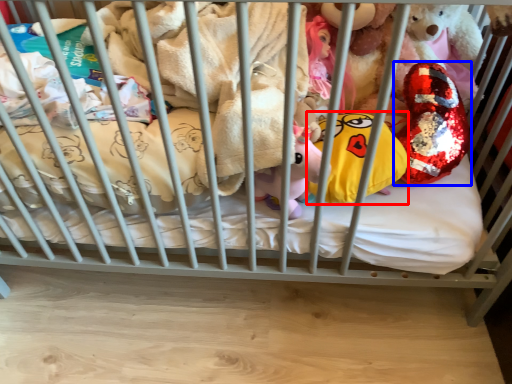
Question: Which object is further to the camera taking this photo, pillow (highlighted by a red box) or toy (highlighted by a blue box)?

Choices:
 (A) pillow
 (B) toy

Answer: (B)